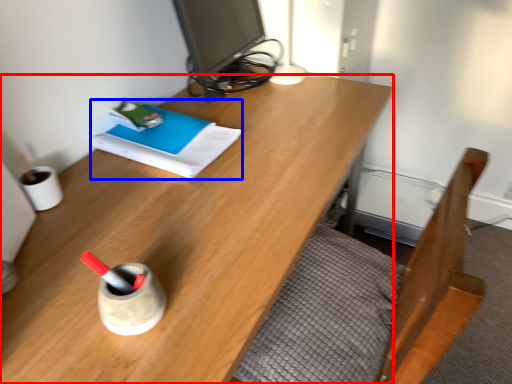
Question: Which of the following is the closest to the observer, desk (highlighted by a red box) or book (highlighted by a blue box)?

Choices:
 (A) desk
 (B) book

Answer: (A)